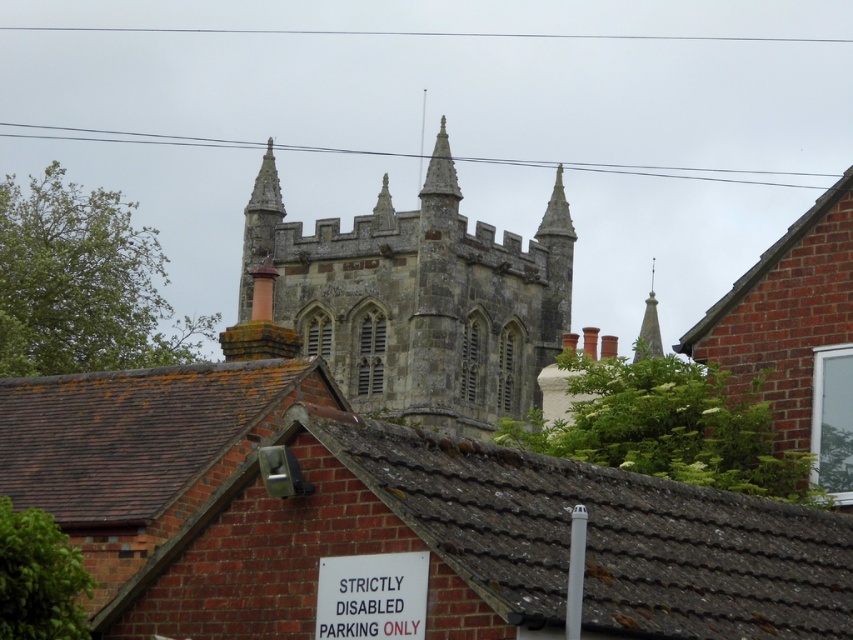
Question: Which object appears closest to the camera in this image?

Choices:
 (A) stone gothic tower at center
 (B) white plastic sign at lower center

Answer: (B)

Question: Does stone gothic tower at center have a greater width compared to white plastic sign at lower center?

Choices:
 (A) yes
 (B) no

Answer: (A)

Question: Can you confirm if stone gothic tower at center is wider than white plastic sign at lower center?

Choices:
 (A) no
 (B) yes

Answer: (B)

Question: Does stone gothic tower at center appear over white plastic sign at lower center?

Choices:
 (A) no
 (B) yes

Answer: (B)

Question: Which point is closer to the camera?

Choices:
 (A) (374, 381)
 (B) (422, 611)

Answer: (B)